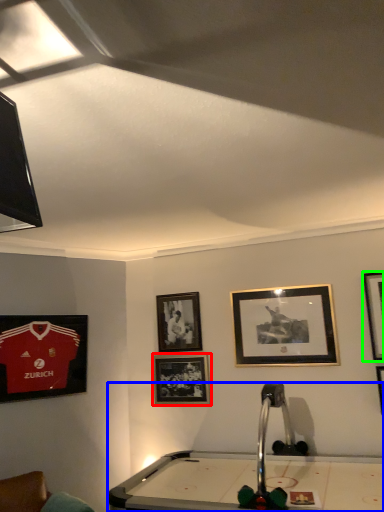
Question: Based on their relative distances, which object is farther from picture frame (highlighted by a red box)? Choose from billiard table (highlighted by a blue box) and picture frame (highlighted by a green box).

Choices:
 (A) billiard table
 (B) picture frame

Answer: (B)